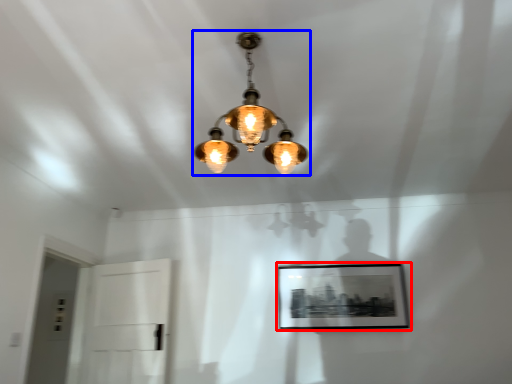
Question: Among these objects, which one is nearest to the camera, picture frame (highlighted by a red box) or lamp (highlighted by a blue box)?

Choices:
 (A) picture frame
 (B) lamp

Answer: (B)